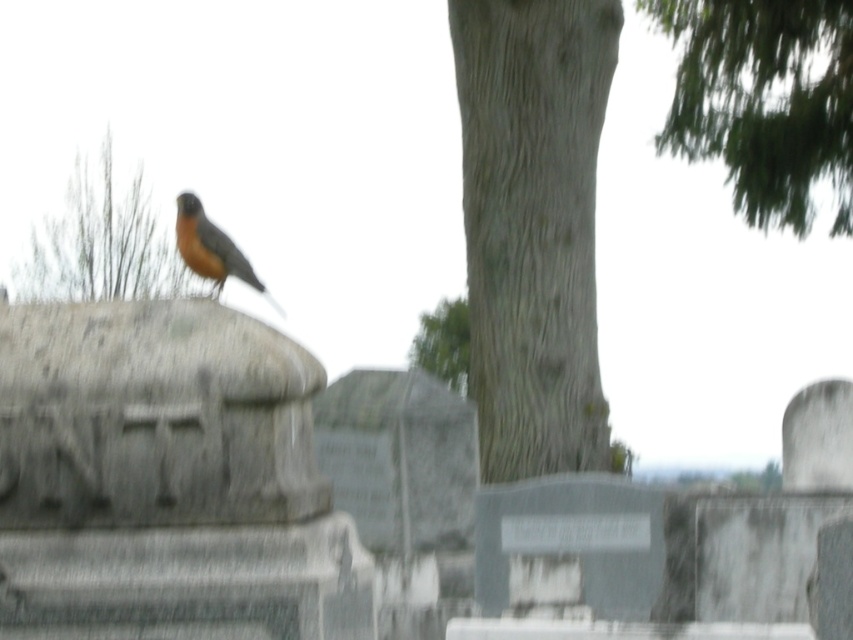
Locate an element on the screen. brown matte bird at center is located at coordinates (210, 248).

This screenshot has width=853, height=640. What do you see at coordinates (210, 248) in the screenshot?
I see `brown matte bird at center` at bounding box center [210, 248].

Who is more forward, (227, 243) or (442, 371)?

Point (227, 243)

What are the coordinates of `brown matte bird at center` in the screenshot? It's located at (210, 248).

Does brown textured tree trunk at upper center have a lesser height compared to brown matte bird at center?

Incorrect, brown textured tree trunk at upper center's height does not fall short of brown matte bird at center's.

Who is positioned more to the right, brown textured tree trunk at upper center or brown matte bird at center?

From the viewer's perspective, brown matte bird at center appears more on the right side.

Who is more forward, (15, 291) or (260, 284)?

Point (260, 284) is in front.

Identify the location of brown textured tree trunk at upper center. (102, 241).

Is green leafy tree at upper right to the right of brown textured tree trunk at upper center from the viewer's perspective?

Indeed, green leafy tree at upper right is positioned on the right side of brown textured tree trunk at upper center.

Between green leafy tree at upper right and brown textured tree trunk at upper center, which one is positioned higher?

green leafy tree at upper right is above.

Image resolution: width=853 pixels, height=640 pixels. In order to click on green leafy tree at upper right in this screenshot , I will do `click(764, 100)`.